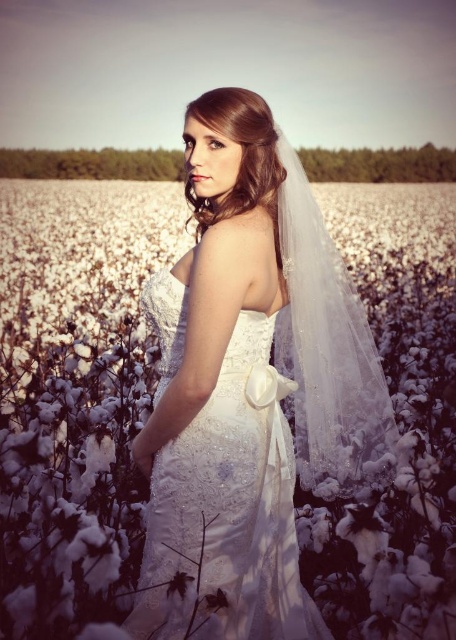
Question: Which of the following is the farthest from the observer?

Choices:
 (A) white lace veil at upper center
 (B) satin white dress at center

Answer: (B)

Question: In this image, where is white lace veil at upper center located relative to satin white dress at center?

Choices:
 (A) right
 (B) left

Answer: (B)

Question: Can you confirm if white lace veil at upper center is thinner than satin white dress at center?

Choices:
 (A) yes
 (B) no

Answer: (B)

Question: Is white lace veil at upper center further to the viewer compared to satin white dress at center?

Choices:
 (A) no
 (B) yes

Answer: (A)

Question: Which point is closer to the camera?

Choices:
 (A) satin white dress at center
 (B) white lace veil at upper center

Answer: (B)